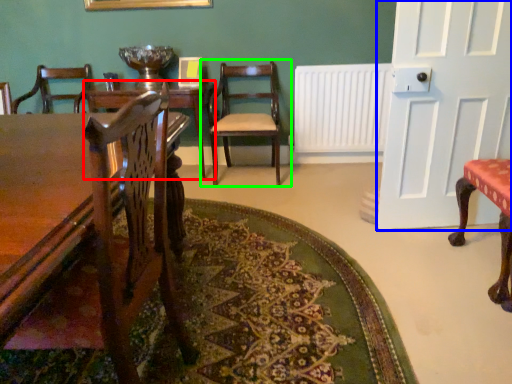
Question: Considering the real-world distances, which object is closest to table (highlighted by a red box)? door (highlighted by a blue box) or chair (highlighted by a green box).

Choices:
 (A) door
 (B) chair

Answer: (B)